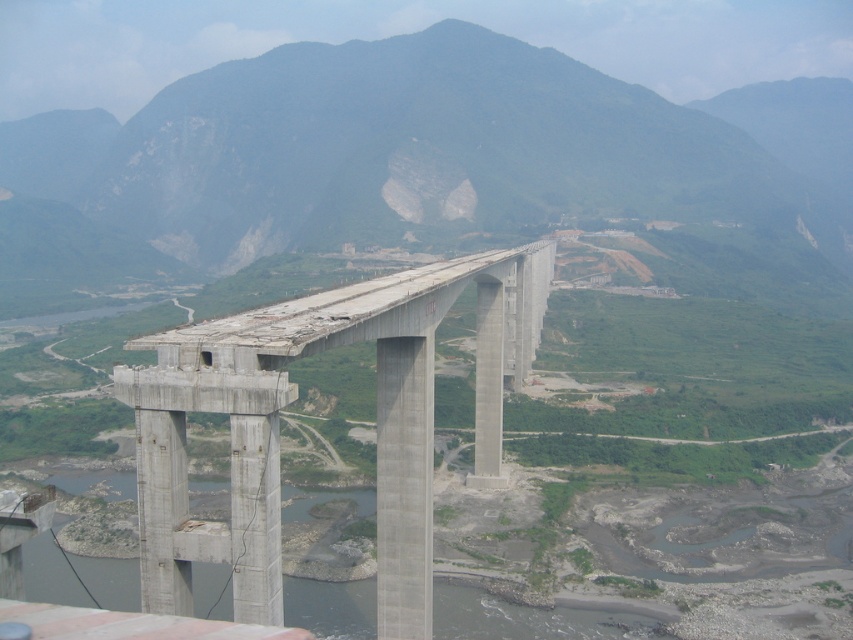
Question: Does concrete bridge at center appear on the right side of gray concrete river at lower center?

Choices:
 (A) yes
 (B) no

Answer: (B)

Question: Which object is farther from the camera taking this photo?

Choices:
 (A) concrete bridge at center
 (B) gray concrete river at lower center
 (C) green rock mountain at center

Answer: (C)

Question: Can you confirm if green rock mountain at center is positioned to the right of concrete bridge at center?

Choices:
 (A) yes
 (B) no

Answer: (A)

Question: Which point appears farthest from the camera in this image?

Choices:
 (A) (844, 205)
 (B) (788, 493)
 (C) (267, 365)

Answer: (A)

Question: Is concrete bridge at center thinner than gray concrete river at lower center?

Choices:
 (A) yes
 (B) no

Answer: (A)

Question: Which is farther from the concrete bridge at center?

Choices:
 (A) gray concrete river at lower center
 (B) green rock mountain at center

Answer: (B)